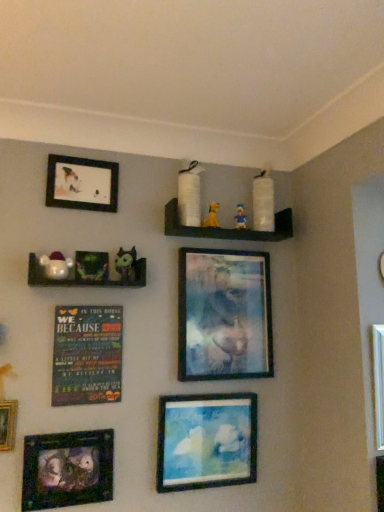
You are a GUI agent. You are given a task and a screenshot of the screen. Output one action in this format:
    pyautogui.click(x=<x>, y=<y>)
    Task: Click on the green rubber donut at upper center, the 2th toy viewed from the left
    This screenshot has width=384, height=512.
    Given the screenshot: What is the action you would take?
    pyautogui.click(x=126, y=265)

What do you see at coordinates (212, 216) in the screenshot? I see `yellow fabric dog at upper center, positioned as the third toy in left-to-right order` at bounding box center [212, 216].

In order to face white glossy plush toy at left, arranged as the 1th toy when viewed from the front, should I rotate leftwards or rightwards?

To align with it, rotate left about 17.531°.

This screenshot has height=512, width=384. In order to click on metallic silver frame at lower left, the fifth picture frame when ordered from right to left in this screenshot , I will do `click(67, 469)`.

What do you see at coordinates (378, 383) in the screenshot? The image size is (384, 512). I see `metallic silver picture frame at upper center, acting as the first picture frame starting from the right` at bounding box center [378, 383].

The height and width of the screenshot is (512, 384). Find the location of `white matte shelves at upper center, which is counted as the 2th shelf, starting from the bottom`. white matte shelves at upper center, which is counted as the 2th shelf, starting from the bottom is located at coordinates (227, 228).

Is multicolored wooden plaque at center-left oriented towards metallic silver frame at center, placed as the second picture frame when sorted from right to left?

No, multicolored wooden plaque at center-left does not turn towards metallic silver frame at center, placed as the second picture frame when sorted from right to left.

From a real-world perspective, is multicolored wooden plaque at center-left on top of metallic silver frame at center, placed as the second picture frame when sorted from right to left?

Actually, multicolored wooden plaque at center-left is physically below metallic silver frame at center, placed as the second picture frame when sorted from right to left, in the real world.

Which of these two, multicolored wooden plaque at center-left or metallic silver frame at center, placed as the second picture frame when sorted from right to left, is thinner?

Thinner between the two is multicolored wooden plaque at center-left.

How much distance is there between white glossy plush toy at left, the first toy positioned from the left, and matte blue painting at lower center, which ranks as the 3th picture frame in right-to-left order?

white glossy plush toy at left, the first toy positioned from the left, and matte blue painting at lower center, which ranks as the 3th picture frame in right-to-left order, are 27.05 inches apart.

Does white glossy plush toy at left, arranged as the 1th toy when viewed from the front, have a greater height compared to matte blue painting at lower center, the third picture frame viewed from the left?

Incorrect, the height of white glossy plush toy at left, arranged as the 1th toy when viewed from the front, is not larger of that of matte blue painting at lower center, the third picture frame viewed from the left.

Between white glossy plush toy at left, the first toy positioned from the left, and matte blue painting at lower center, which ranks as the 3th picture frame in right-to-left order, which one has larger size?

With larger size is matte blue painting at lower center, which ranks as the 3th picture frame in right-to-left order.

Starting from the white matte shelves at upper center, placed as the first shelf when sorted from right to left, which picture frame is the 4th one to the left? Please provide its 2D coordinates.

[(67, 469)]

From the picture: Is white matte shelves at upper center, the second shelf from the left, facing towards metallic silver frame at lower left, the fifth picture frame when ordered from right to left?

No, white matte shelves at upper center, the second shelf from the left, is not turned towards metallic silver frame at lower left, the fifth picture frame when ordered from right to left.

Choose the correct answer: Is white matte shelves at upper center, the second shelf from the left, inside metallic silver frame at lower left, which is the 1th picture frame in left-to-right order, or outside it?

white matte shelves at upper center, the second shelf from the left, is located beyond the bounds of metallic silver frame at lower left, which is the 1th picture frame in left-to-right order.

Would you consider metallic silver frame at center, placed as the second picture frame when sorted from right to left, to be distant from metallic silver frame at lower left, the fifth picture frame when ordered from right to left?

metallic silver frame at center, placed as the second picture frame when sorted from right to left, is actually quite close to metallic silver frame at lower left, the fifth picture frame when ordered from right to left.

Is metallic silver frame at center, marked as the fourth picture frame in a left-to-right arrangement, at the right side of metallic silver frame at lower left, which is the 1th picture frame in left-to-right order?

Indeed, metallic silver frame at center, marked as the fourth picture frame in a left-to-right arrangement, is positioned on the right side of metallic silver frame at lower left, which is the 1th picture frame in left-to-right order.

How different are the orientations of metallic silver frame at center, marked as the fourth picture frame in a left-to-right arrangement, and metallic silver frame at lower left, which is the 1th picture frame in left-to-right order, in degrees?

The angle between the facing direction of metallic silver frame at center, marked as the fourth picture frame in a left-to-right arrangement, and the facing direction of metallic silver frame at lower left, which is the 1th picture frame in left-to-right order, is 1.93 degrees.

Is metallic silver frame at center, placed as the second picture frame when sorted from right to left, positioned behind metallic silver frame at lower left, which is the 1th picture frame in left-to-right order?

Yes, metallic silver frame at center, placed as the second picture frame when sorted from right to left, is behind metallic silver frame at lower left, which is the 1th picture frame in left-to-right order.

Is point (55, 284) positioned after point (71, 450)?

Yes, point (55, 284) is behind point (71, 450).

You are a GUI agent. You are given a task and a screenshot of the screen. Output one action in this format:
    pyautogui.click(x=<x>, y=<y>)
    Task: Click on the 1st shelf located above the metallic silver frame at lower left, which is the 1th picture frame in left-to-right order (from a real-world perspective)
    
    Given the screenshot: What is the action you would take?
    pyautogui.click(x=82, y=279)

Considering the relative sizes of metallic green figurines at left, the second shelf when ordered from back to front, and metallic silver frame at lower left, the fifth picture frame when ordered from right to left, in the image provided, is metallic green figurines at left, the second shelf when ordered from back to front, taller than metallic silver frame at lower left, the fifth picture frame when ordered from right to left,?

No.

Which object is positioned more to the left, matte blue painting at lower center, the third picture frame viewed from the left, or multicolored wooden plaque at center-left?

From the viewer's perspective, multicolored wooden plaque at center-left appears more on the left side.

Is point (166, 450) farther from camera compared to point (58, 376)?

Yes.

How distant is matte blue painting at lower center, the third picture frame viewed from the left, from multicolored wooden plaque at center-left?

The distance of matte blue painting at lower center, the third picture frame viewed from the left, from multicolored wooden plaque at center-left is 12.59 inches.

Considering the sizes of objects matte blue painting at lower center, the third picture frame viewed from the left, and multicolored wooden plaque at center-left in the image provided, who is thinner, matte blue painting at lower center, the third picture frame viewed from the left, or multicolored wooden plaque at center-left?

multicolored wooden plaque at center-left is thinner.

Can you confirm if metallic silver frame at lower left, the fifth picture frame when ordered from right to left, is shorter than matte black picture frame at upper left, positioned as the 4th picture frame in right-to-left order?

No.

Considering the positions of objects metallic silver frame at lower left, which is the 1th picture frame in left-to-right order, and matte black picture frame at upper left, positioned as the 4th picture frame in right-to-left order, in the image provided, who is more to the left, metallic silver frame at lower left, which is the 1th picture frame in left-to-right order, or matte black picture frame at upper left, positioned as the 4th picture frame in right-to-left order,?

Positioned to the left is metallic silver frame at lower left, which is the 1th picture frame in left-to-right order.

Is metallic silver frame at lower left, the fifth picture frame when ordered from right to left, behind matte black picture frame at upper left, positioned as the 4th picture frame in right-to-left order?

No, metallic silver frame at lower left, the fifth picture frame when ordered from right to left, is closer to the camera.

Is metallic silver frame at lower left, the fifth picture frame when ordered from right to left, inside the boundaries of matte black picture frame at upper left, positioned as the 4th picture frame in right-to-left order, or outside?

metallic silver frame at lower left, the fifth picture frame when ordered from right to left, exists outside the volume of matte black picture frame at upper left, positioned as the 4th picture frame in right-to-left order.

Locate an element on the screen. plaque that appears below the metallic silver frame at center, marked as the fourth picture frame in a left-to-right arrangement (from the image's perspective) is located at coordinates (87, 355).

Starting from the matte blue painting at lower center, which ranks as the 3th picture frame in right-to-left order, which toy is the 2nd one in front? Please provide its 2D coordinates.

[(56, 265)]

When comparing their distances from white matte shelves at upper center, which is counted as the 2th shelf, starting from the bottom, does metallic silver frame at center, placed as the second picture frame when sorted from right to left, or matte black picture frame at upper left, marked as the 2th picture frame in a left-to-right arrangement, seem closer?

metallic silver frame at center, placed as the second picture frame when sorted from right to left.

Considering their positions, is blue fabric toy at upper center, which is the fourth toy from front to back, positioned further to multicolored wooden plaque at center-left than metallic green figurines at left, the second shelf when ordered from right to left?

blue fabric toy at upper center, which is the fourth toy from front to back, is further to multicolored wooden plaque at center-left.

Based on their spatial positions, is green rubber donut at upper center, which is the third toy from back to front, or matte blue painting at lower center, which ranks as the 3th picture frame in right-to-left order, further from multicolored wooden plaque at center-left?

The object further to multicolored wooden plaque at center-left is matte blue painting at lower center, which ranks as the 3th picture frame in right-to-left order.

Looking at the image, which one is located closer to metallic green figurines at left, the 1th shelf when ordered from bottom to top, white matte shelves at upper center, which is counted as the 2th shelf, starting from the bottom, or white glossy plush toy at left, the fourth toy positioned from the right?

Based on the image, white glossy plush toy at left, the fourth toy positioned from the right, appears to be nearer to metallic green figurines at left, the 1th shelf when ordered from bottom to top.

Estimate the real-world distances between objects in this image. Which object is further from metallic silver frame at center, placed as the second picture frame when sorted from right to left, multicolored wooden plaque at center-left or white glossy plush toy at left, the first toy positioned from the left?

The object further to metallic silver frame at center, placed as the second picture frame when sorted from right to left, is white glossy plush toy at left, the first toy positioned from the left.

When comparing their distances from metallic green figurines at left, the 1th shelf when ordered from bottom to top, does matte blue painting at lower center, the third picture frame viewed from the left, or green rubber donut at upper center, which is the third toy from back to front, seem closer?

green rubber donut at upper center, which is the third toy from back to front, is positioned closer to the anchor metallic green figurines at left, the 1th shelf when ordered from bottom to top.

Based on their spatial positions, is blue fabric toy at upper center, the 4th toy when ordered from left to right, or metallic silver frame at center, placed as the second picture frame when sorted from right to left, closer to metallic green figurines at left, arranged as the first shelf when viewed from the front?

metallic silver frame at center, placed as the second picture frame when sorted from right to left, is positioned closer to the anchor metallic green figurines at left, arranged as the first shelf when viewed from the front.

Which object lies further to the anchor point multicolored wooden plaque at center-left, matte blue painting at lower center, the third picture frame viewed from the left, or white glossy plush toy at left, arranged as the 1th toy when viewed from the front?

Among the two, matte blue painting at lower center, the third picture frame viewed from the left, is located further to multicolored wooden plaque at center-left.

You are a GUI agent. You are given a task and a screenshot of the screen. Output one action in this format:
    pyautogui.click(x=<x>, y=<y>)
    Task: Click on the plaque between metallic green figurines at left, the 1th shelf when ordered from bottom to top, and matte blue painting at lower center, which ranks as the 3th picture frame in right-to-left order, in the up-down direction
    
    Given the screenshot: What is the action you would take?
    pyautogui.click(x=87, y=355)

Locate an element on the screen. The width and height of the screenshot is (384, 512). plaque between matte black picture frame at upper left, marked as the 2th picture frame in a left-to-right arrangement, and metallic silver picture frame at upper center, acting as the first picture frame starting from the right, from left to right is located at coordinates (87, 355).

Find the location of a particular element. This screenshot has width=384, height=512. picture frame between matte black picture frame at upper left, positioned as the 4th picture frame in right-to-left order, and multicolored wooden plaque at center-left vertically is located at coordinates pyautogui.click(x=224, y=315).

At what (x,y) coordinates should I click in order to perform the action: click on toy situated between white matte shelves at upper center, which appears as the first shelf when viewed from the top, and metallic silver picture frame at upper center, acting as the first picture frame starting from the right, from left to right. Please return your answer as a coordinate pair (x, y). The height and width of the screenshot is (512, 384). Looking at the image, I should click on (240, 217).